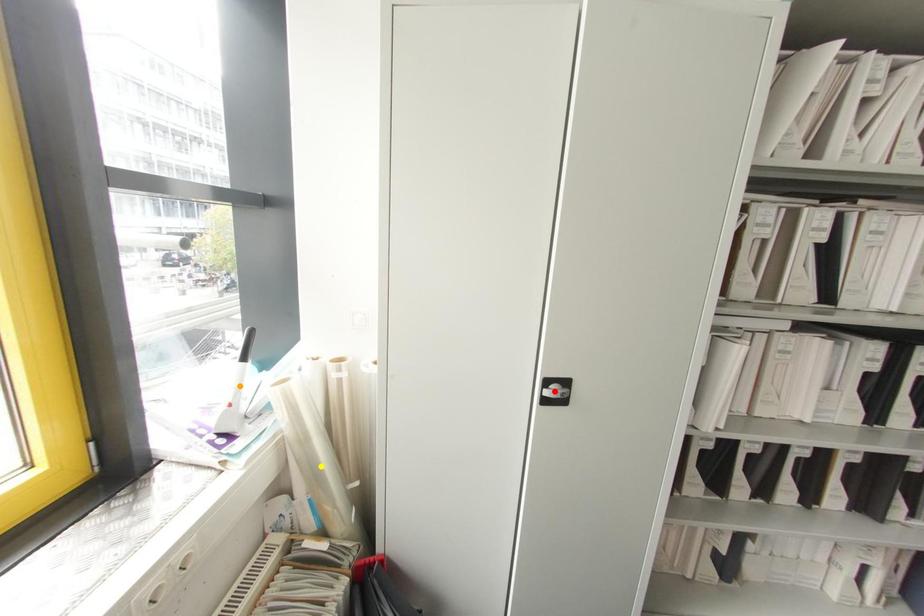
Order these from nearest to farthest:
- yellow point
- orange point
- red point

1. orange point
2. yellow point
3. red point